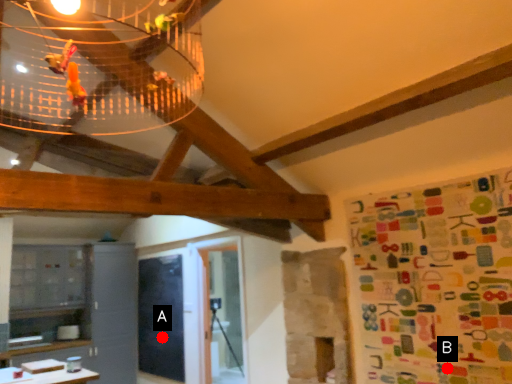
Question: Two points are circled on the image, labeled by A and B beside each circle. Which point appears closest to the camera in this image?

Choices:
 (A) A is closer
 (B) B is closer

Answer: (B)